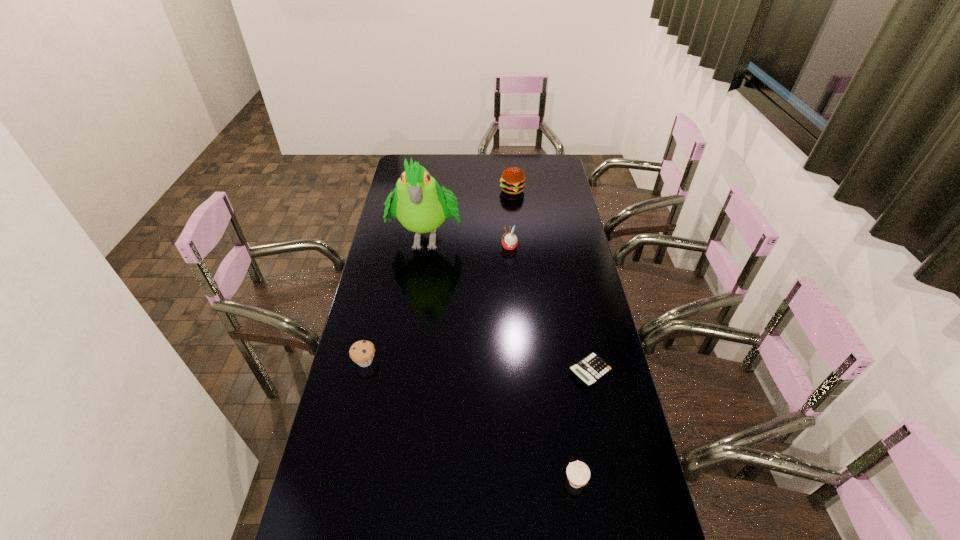
Find the location of a particular element. Image resolution: width=960 pixels, height=540 pixels. parakeet is located at coordinates (419, 204).

Where is `hamburger`? hamburger is located at coordinates (512, 181).

Locate an element on the screen. This screenshot has height=540, width=960. the farthest muffin is located at coordinates 509,240.

Where is `the second muffin from right to left`? the second muffin from right to left is located at coordinates pyautogui.click(x=509, y=240).

You are a GUI agent. You are given a task and a screenshot of the screen. Output one action in this format:
    pyautogui.click(x=<x>, y=<y>)
    Task: Click on the rightmost muffin
    The width and height of the screenshot is (960, 540).
    Given the screenshot: What is the action you would take?
    pyautogui.click(x=578, y=473)

This screenshot has height=540, width=960. I want to click on the nearest muffin, so click(578, 473).

Where is `the second farthest muffin`? This screenshot has height=540, width=960. the second farthest muffin is located at coordinates (362, 352).

This screenshot has height=540, width=960. Identify the location of the shortest object. (591, 369).

The width and height of the screenshot is (960, 540). Find the location of `vacant space located on the beak of the tallest object`. vacant space located on the beak of the tallest object is located at coordinates (415, 318).

The height and width of the screenshot is (540, 960). In order to click on free point located on the right of the farthest object in this screenshot , I will do `click(536, 190)`.